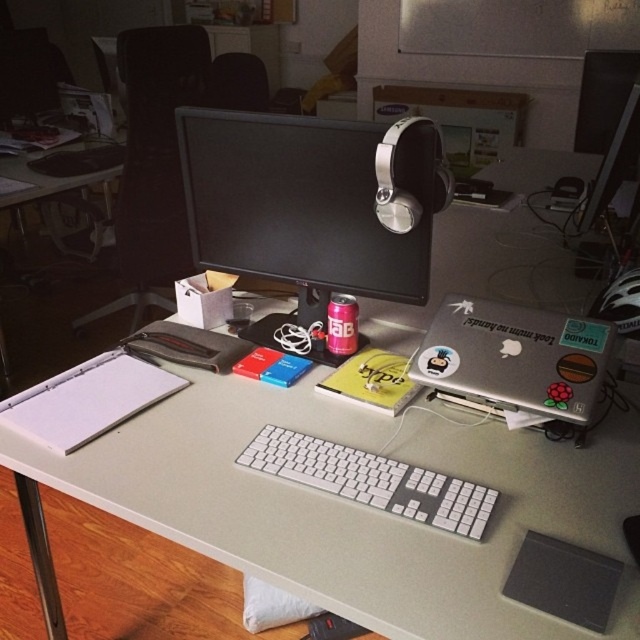
Can you confirm if white plastic keyboard at center is wider than matte black monitor at upper center?

Yes, white plastic keyboard at center is wider than matte black monitor at upper center.

Does white plastic keyboard at center appear under matte black monitor at upper center?

Yes.

Who is more distant from viewer, (356,452) or (616,141)?

Positioned behind is point (616,141).

This screenshot has height=640, width=640. Identify the location of white plastic keyboard at center. (372, 481).

Who is more distant from viewer, (573, 397) or (632, 102)?

The point (632, 102) is more distant.

Is silver metallic laptop at center wider than matte black monitor at upper center?

Yes.

The height and width of the screenshot is (640, 640). What do you see at coordinates (515, 356) in the screenshot?
I see `silver metallic laptop at center` at bounding box center [515, 356].

The width and height of the screenshot is (640, 640). I want to click on silver metallic laptop at center, so click(515, 356).

Based on the photo, between silver metallic laptop at center and white plastic keyboard at center, which one appears on the right side from the viewer's perspective?

From the viewer's perspective, silver metallic laptop at center appears more on the right side.

In the scene shown: Who is higher up, silver metallic laptop at center or white plastic keyboard at center?

silver metallic laptop at center is above.

The width and height of the screenshot is (640, 640). I want to click on silver metallic laptop at center, so click(515, 356).